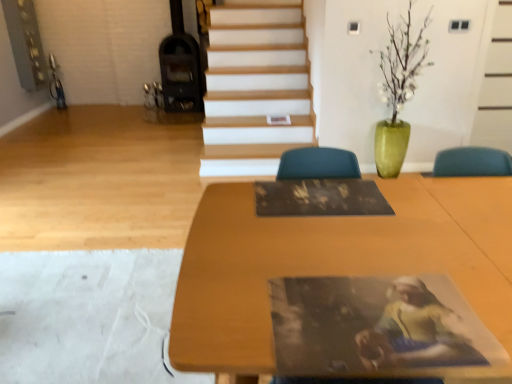
Question: Based on their positions, is dark brown wood fireplace at upper left located to the left or right of wooden table at center?

Choices:
 (A) right
 (B) left

Answer: (B)

Question: From a real-world perspective, is dark brown wood fireplace at upper left positioned above or below wooden table at center?

Choices:
 (A) below
 (B) above

Answer: (B)

Question: Considering their positions, is dark brown wood fireplace at upper left located in front of or behind wooden table at center?

Choices:
 (A) front
 (B) behind

Answer: (B)

Question: From a real-world perspective, relative to dark brown wood fireplace at upper left, is wooden table at center vertically above or below?

Choices:
 (A) below
 (B) above

Answer: (A)

Question: From the image's perspective, is wooden table at center above or below dark brown wood fireplace at upper left?

Choices:
 (A) above
 (B) below

Answer: (B)

Question: Is wooden table at center to the left or to the right of dark brown wood fireplace at upper left in the image?

Choices:
 (A) right
 (B) left

Answer: (A)

Question: Is wooden table at center spatially inside dark brown wood fireplace at upper left, or outside of it?

Choices:
 (A) outside
 (B) inside

Answer: (A)